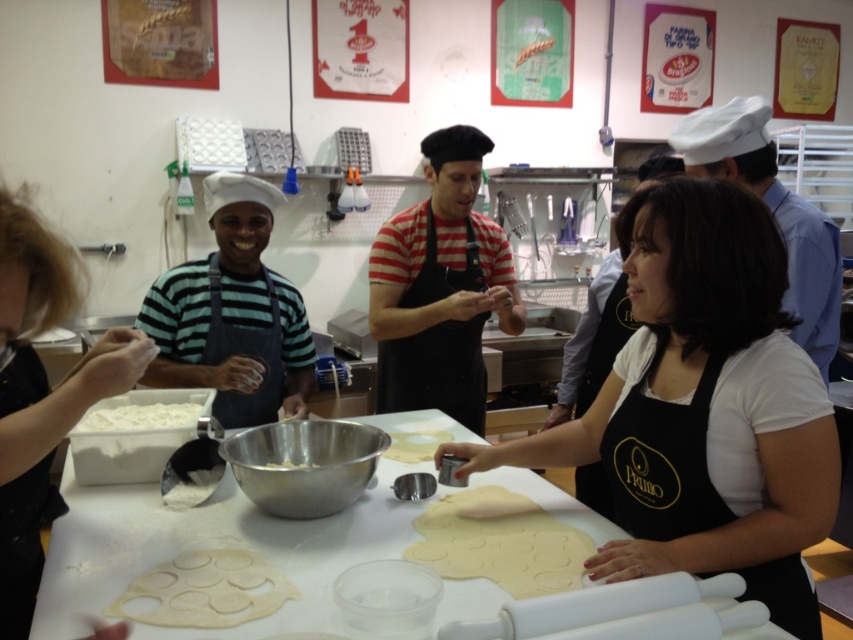
Question: Where is striped cotton shirt at center located in relation to clear plastic dough at center in the image?

Choices:
 (A) below
 (B) above

Answer: (B)

Question: Considering the real-world distances, which object is farthest from the black matte apron at center?

Choices:
 (A) white dough at center
 (B) black matte apron at left
 (C) white powder at center
 (D) clear plastic dough at center

Answer: (C)

Question: Which object is closer to the camera taking this photo?

Choices:
 (A) white matte dough at center
 (B) white powder at center
 (C) black matte apron at center

Answer: (C)

Question: Does black matte apron at left appear on the right side of clear plastic dough at center?

Choices:
 (A) yes
 (B) no

Answer: (B)

Question: Estimate the real-world distances between objects in this image. Which object is farther from the white matte bowl at center?

Choices:
 (A) green striped shirt at center
 (B) white powder at center
 (C) white dough at center
 (D) white matte dough at center

Answer: (A)

Question: Is white matte dough at center thinner than white matte bowl at center?

Choices:
 (A) yes
 (B) no

Answer: (B)